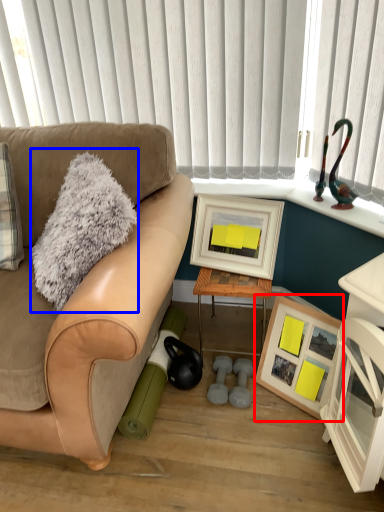
Question: Which object is closer to the camera taking this photo, picture frame (highlighted by a red box) or throw pillow (highlighted by a blue box)?

Choices:
 (A) picture frame
 (B) throw pillow

Answer: (B)